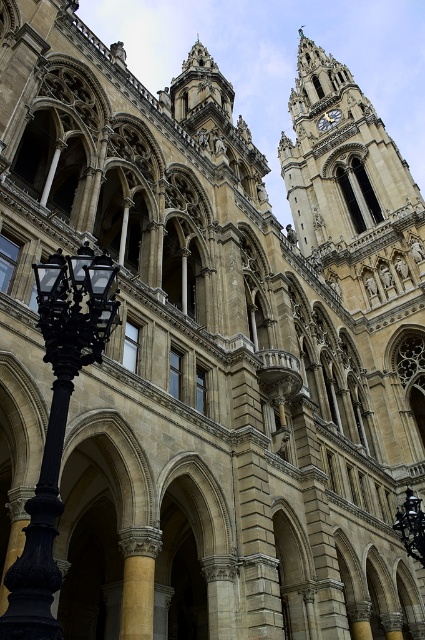
Question: Which object is closer to the camera taking this photo?

Choices:
 (A) stone clock tower at upper right
 (B) black wrought iron streetlight at left

Answer: (B)

Question: Can you confirm if black wrought iron streetlight at left is thinner than gold metallic clock at upper center?

Choices:
 (A) no
 (B) yes

Answer: (A)

Question: Which point appears farthest from the camera in this image?

Choices:
 (A) (x=336, y=113)
 (B) (x=90, y=353)
 (C) (x=367, y=273)

Answer: (A)

Question: Can you confirm if stone clock tower at upper right is positioned above black wrought iron streetlight at left?

Choices:
 (A) yes
 (B) no

Answer: (A)

Question: Can you confirm if black wrought iron streetlight at left is bigger than gold metallic clock at upper center?

Choices:
 (A) no
 (B) yes

Answer: (B)

Question: Which of these objects is positioned closest to the gold metallic clock at upper center?

Choices:
 (A) black wrought iron streetlight at left
 (B) stone clock tower at upper right

Answer: (B)